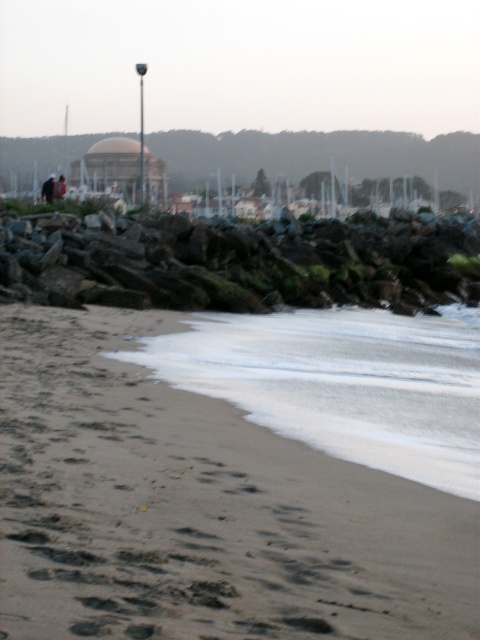
Question: Considering the relative positions of sandy brown at lower left and white foam water at lower center in the image provided, where is sandy brown at lower left located with respect to white foam water at lower center?

Choices:
 (A) above
 (B) below

Answer: (B)

Question: Does sandy brown at lower left have a smaller size compared to white foam water at lower center?

Choices:
 (A) no
 (B) yes

Answer: (B)

Question: Which object appears closest to the camera in this image?

Choices:
 (A) dark brown leather jacket at center
 (B) white foam water at lower center
 (C) dark brown leather jacket at lower left

Answer: (B)

Question: Which object is positioned farthest from the white foam water at lower center?

Choices:
 (A) dark brown leather jacket at center
 (B) dark gray rough rocks at center
 (C) dark brown leather jacket at lower left
 (D) sandy brown at lower left

Answer: (A)

Question: Is white foam water at lower center positioned in front of dark brown leather jacket at lower left?

Choices:
 (A) yes
 (B) no

Answer: (A)

Question: Considering the real-world distances, which object is farthest from the dark brown leather jacket at center?

Choices:
 (A) dark brown leather jacket at lower left
 (B) sandy brown at lower left
 (C) white foam water at lower center

Answer: (B)